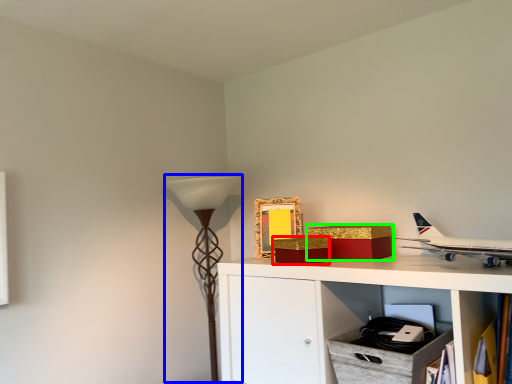
Question: Which object is positioned closest to box (highlighted by a red box)? Select from table lamp (highlighted by a blue box) and box (highlighted by a green box).

Choices:
 (A) table lamp
 (B) box

Answer: (B)